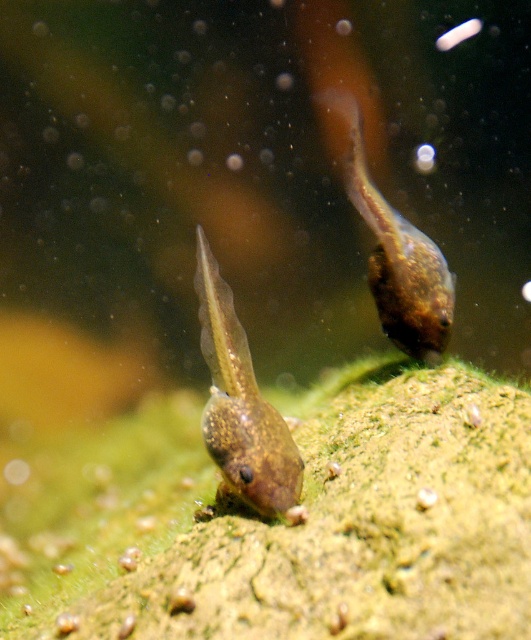
Is translucent gelatinous tadpole at center wider than translucent gelatinous tadpole at upper right?

No.

Which is more to the right, translucent gelatinous tadpole at center or translucent gelatinous tadpole at upper right?

From the viewer's perspective, translucent gelatinous tadpole at upper right appears more on the right side.

Between point (271, 477) and point (423, 232), which one is positioned in front?

Point (271, 477) is in front.

Find the location of a particular element. translucent gelatinous tadpole at center is located at coordinates (241, 404).